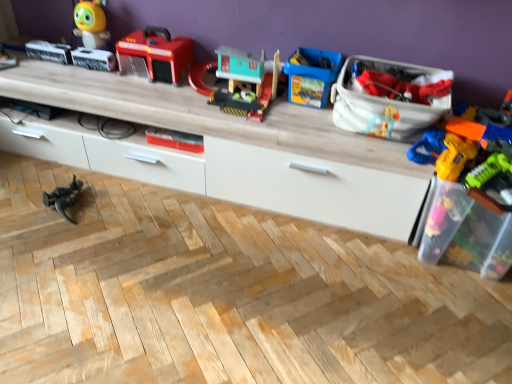
The image size is (512, 384). Find the location of `free space in front of matte plastic fire truck at upper center, which is the 5th toy from right to left`. free space in front of matte plastic fire truck at upper center, which is the 5th toy from right to left is located at coordinates (143, 92).